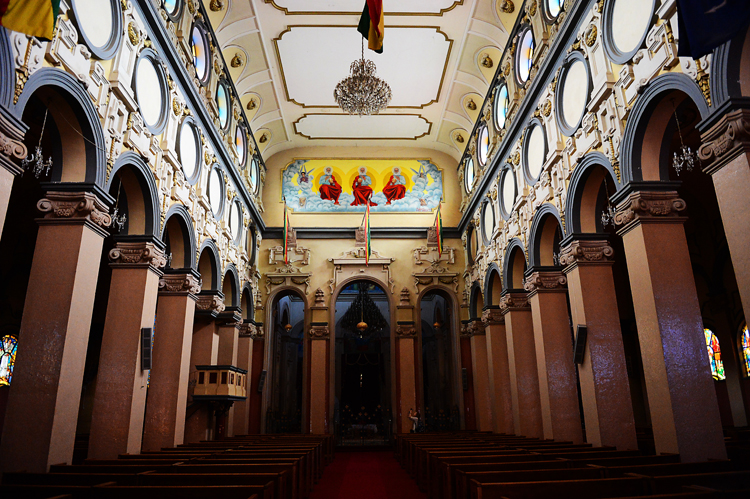
Where is `chandelier`? The height and width of the screenshot is (499, 750). chandelier is located at coordinates (368, 94).